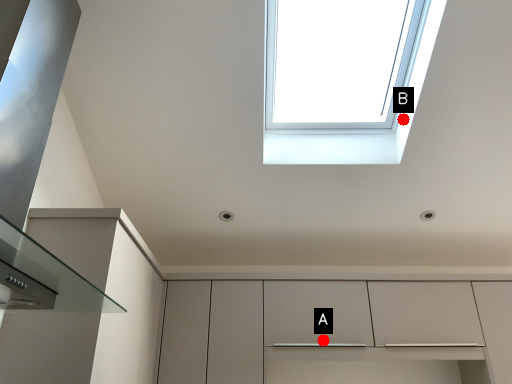
Question: Two points are circled on the image, labeled by A and B beside each circle. Which point is further to the camera?

Choices:
 (A) A is further
 (B) B is further

Answer: (A)